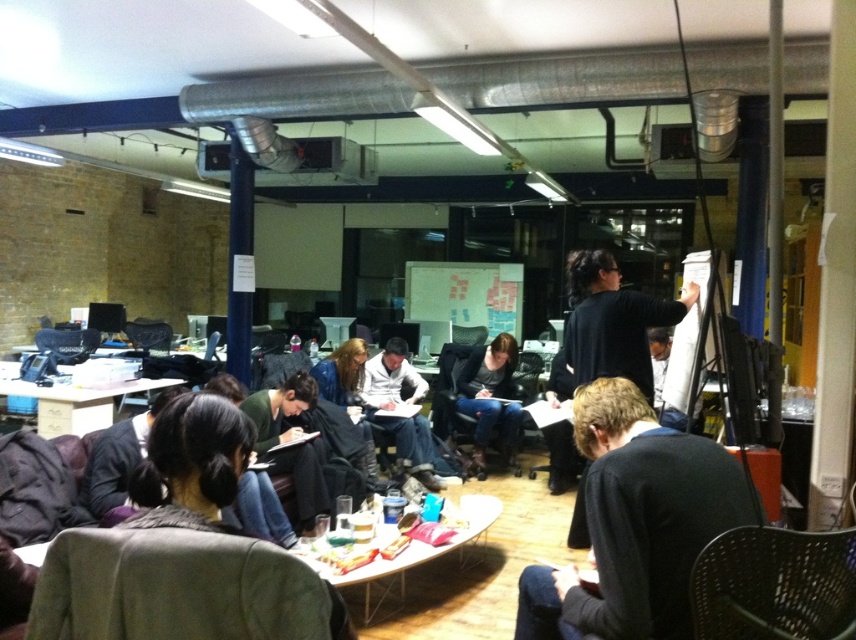
Does matte white shirt at center appear under denim jeans at center?

Correct, matte white shirt at center is located below denim jeans at center.

Between point (394, 406) and point (500, 337), which one is positioned in front?

Point (394, 406) is in front.

Locate an element on the screen. matte white shirt at center is located at coordinates (399, 408).

Between point (604, 454) and point (501, 385), which one is positioned behind?

Positioned behind is point (501, 385).

Is black sweater at lower right behind denim jeans at center?

No, it is not.

Does point (746, 497) come in front of point (468, 378)?

Yes.

What are the coordinates of `black sweater at lower right` in the screenshot? It's located at (635, 522).

Identify the location of black sweater at lower right. This screenshot has height=640, width=856. (635, 522).

Is black sweater at lower right positioned in front of matte white shirt at center?

Yes, black sweater at lower right is closer to the viewer.

What do you see at coordinates (635, 522) in the screenshot?
I see `black sweater at lower right` at bounding box center [635, 522].

This screenshot has width=856, height=640. What are the coordinates of `black sweater at lower right` in the screenshot? It's located at (635, 522).